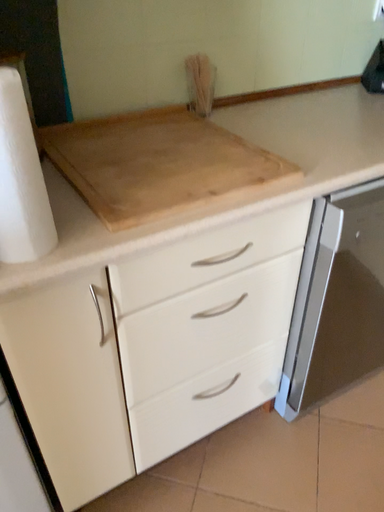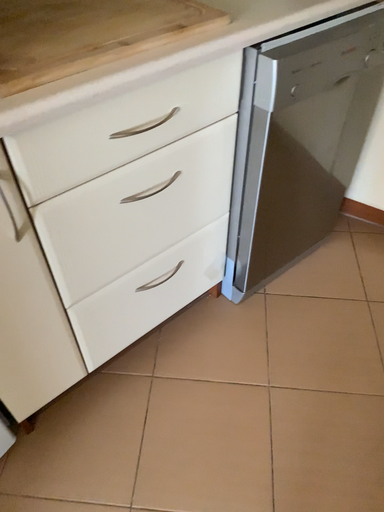
Question: How did the camera likely rotate when shooting the video?

Choices:
 (A) rotated right
 (B) rotated left

Answer: (A)